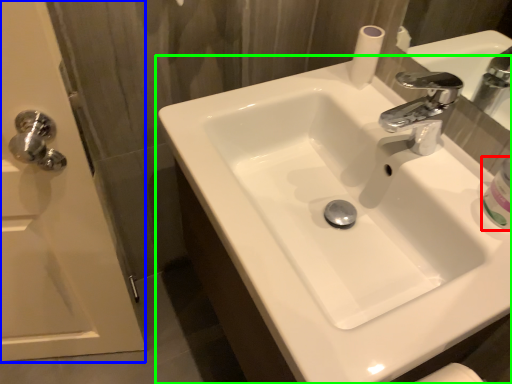
Question: Estimate the real-world distances between objects in this image. Which object is closer to mouthwash (highlighted by a red box), screen door (highlighted by a blue box) or sink (highlighted by a green box)?

Choices:
 (A) screen door
 (B) sink

Answer: (B)